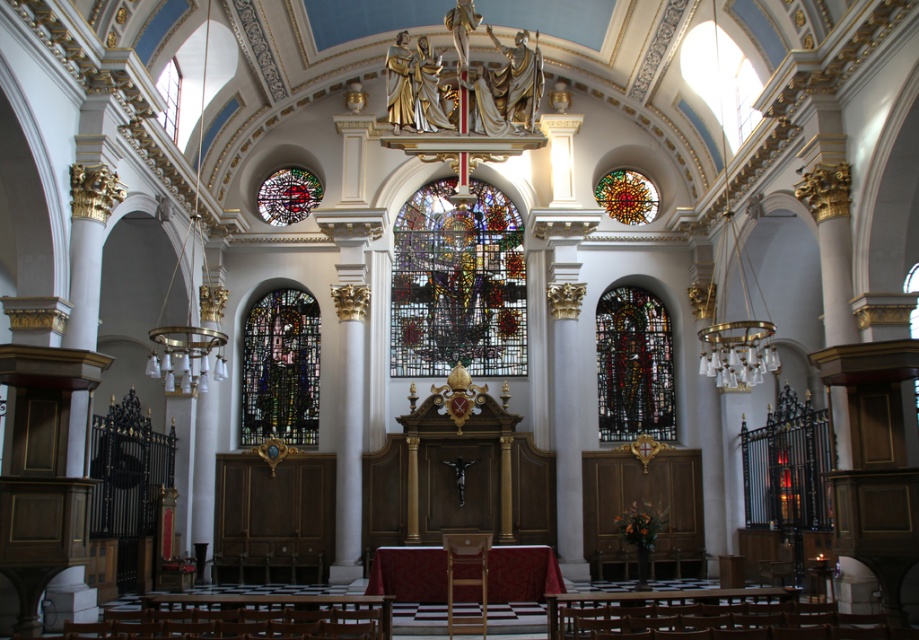
Is multicolored stained glass at center left wider than multicolored stained glass at upper center?

Yes, multicolored stained glass at center left is wider than multicolored stained glass at upper center.

Between point (290, 376) and point (320, 188), which one is positioned behind?

Point (320, 188)

Identify the location of multicolored stained glass at center left. The height and width of the screenshot is (640, 919). click(281, 369).

Who is lower down, multicolored stained glass at center left or multicolored stained glass at center?

multicolored stained glass at center left is below.

Can you confirm if multicolored stained glass at center left is positioned to the left of multicolored stained glass at center?

Indeed, multicolored stained glass at center left is positioned on the left side of multicolored stained glass at center.

Where is `multicolored stained glass at center left`? multicolored stained glass at center left is located at coordinates (281, 369).

Locate an element on the screen. The image size is (919, 640). multicolored stained glass at center left is located at coordinates (281, 369).

Between multicolored stained glass at upper center and wooden polished chair at center, which one appears on the right side from the viewer's perspective?

wooden polished chair at center

Which is behind, point (299, 192) or point (485, 554)?

Positioned behind is point (299, 192).

Identify the location of multicolored stained glass at upper center. (288, 195).